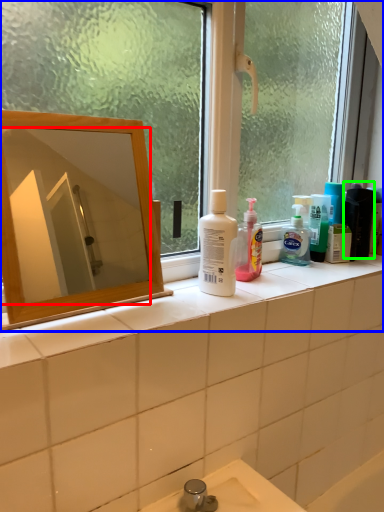
Question: Which is farther away from mirror (highlighted by a red box)? window (highlighted by a blue box) or toiletry (highlighted by a green box)?

Choices:
 (A) window
 (B) toiletry

Answer: (B)